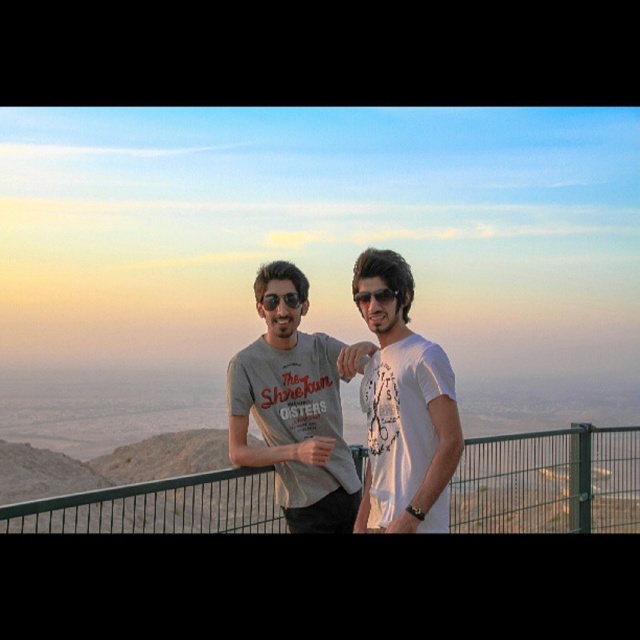
Based on the coordinates provided in the image, can you identify the object located at point (403,404)?

The object located at point (403,404) is the white matte t shirt at center.